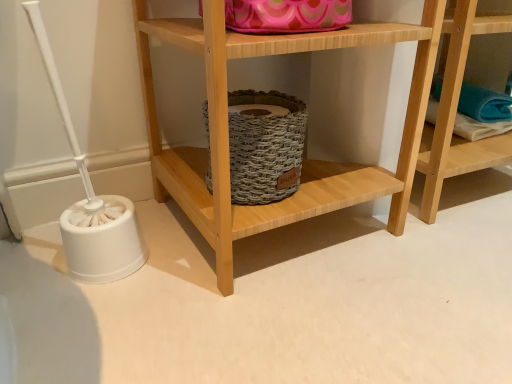
This screenshot has width=512, height=384. In order to click on wooden shelf at center in this screenshot , I will do `click(305, 160)`.

The width and height of the screenshot is (512, 384). Describe the element at coordinates (305, 160) in the screenshot. I see `wooden shelf at center` at that location.

What is the approximate height of wooden shelf at center?

wooden shelf at center is 15.01 inches in height.

Measure the distance between wooden shelf at center and camera.

The depth of wooden shelf at center is 17.20 inches.

Image resolution: width=512 pixels, height=384 pixels. I want to click on wooden shelf at center, so click(x=305, y=160).